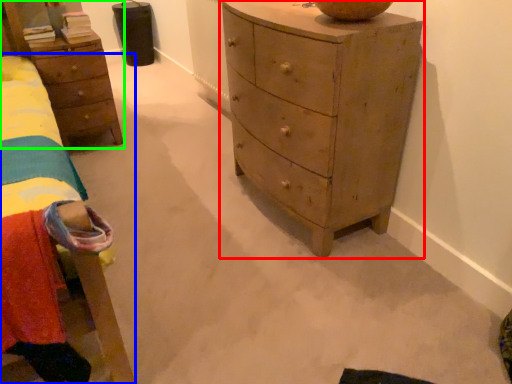
Question: Considering the real-world distances, which object is farthest from chest of drawers (highlighted by a red box)? bed (highlighted by a blue box) or nightstand (highlighted by a green box)?

Choices:
 (A) bed
 (B) nightstand

Answer: (B)